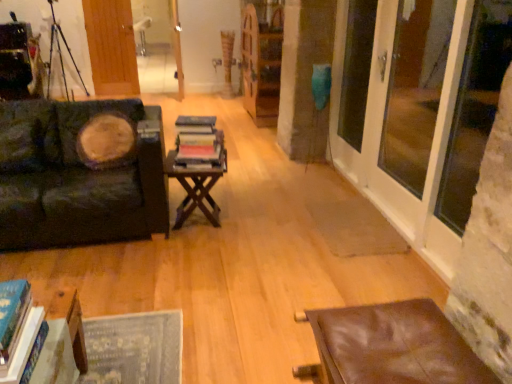
This screenshot has width=512, height=384. In order to click on vacant space underneath brown wooden table at center, placed as the third table when sorted from bottom to top (from a real-world perspective) in this screenshot , I will do `click(199, 223)`.